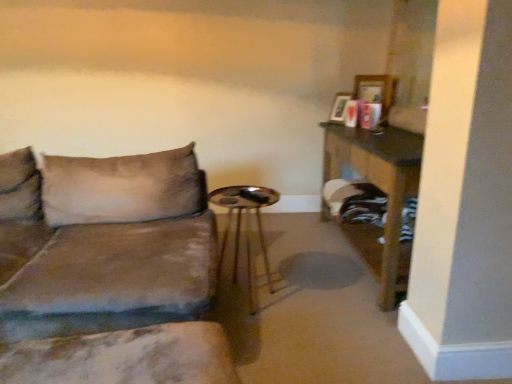
The height and width of the screenshot is (384, 512). Find the location of `vacant area on top of marble-patterned cushion at lower left (from a real-world perspective)`. vacant area on top of marble-patterned cushion at lower left (from a real-world perspective) is located at coordinates (117, 352).